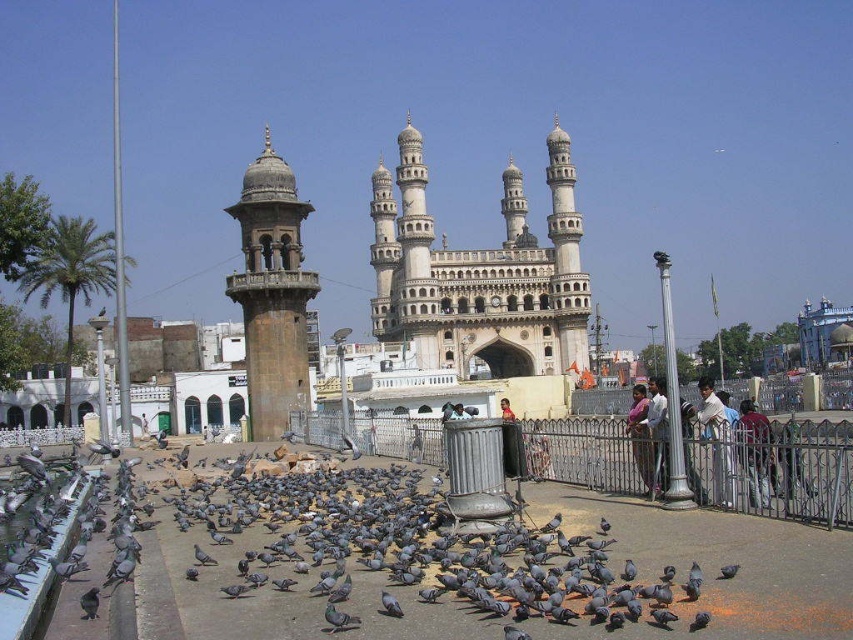
Looking at this image, is light blue shirt at center positioned at the back of dark brown leather jacket at center?

No, light blue shirt at center is closer to the viewer.

Identify the location of light blue shirt at center. This screenshot has height=640, width=853. 646,435.

Measure the distance between light blue shirt at center and camera.

A distance of 82.13 meters exists between light blue shirt at center and camera.

Image resolution: width=853 pixels, height=640 pixels. Find the location of `light blue shirt at center`. light blue shirt at center is located at coordinates [646, 435].

Which is more to the left, stone carved archway at center or gray matte pigeon at center?

stone carved archway at center

Which is below, stone carved archway at center or gray matte pigeon at center?

Positioned lower is gray matte pigeon at center.

Locate an element on the screen. stone carved archway at center is located at coordinates (480, 275).

Is white cotton shirt at right to the left of gray matte pigeon at center from the viewer's perspective?

No, white cotton shirt at right is not to the left of gray matte pigeon at center.

Is white cotton shirt at right smaller than gray matte pigeon at center?

Incorrect, white cotton shirt at right is not smaller in size than gray matte pigeon at center.

Is point (732, 480) closer to viewer compared to point (730, 573)?

That is False.

I want to click on white cotton shirt at right, so pyautogui.click(x=717, y=440).